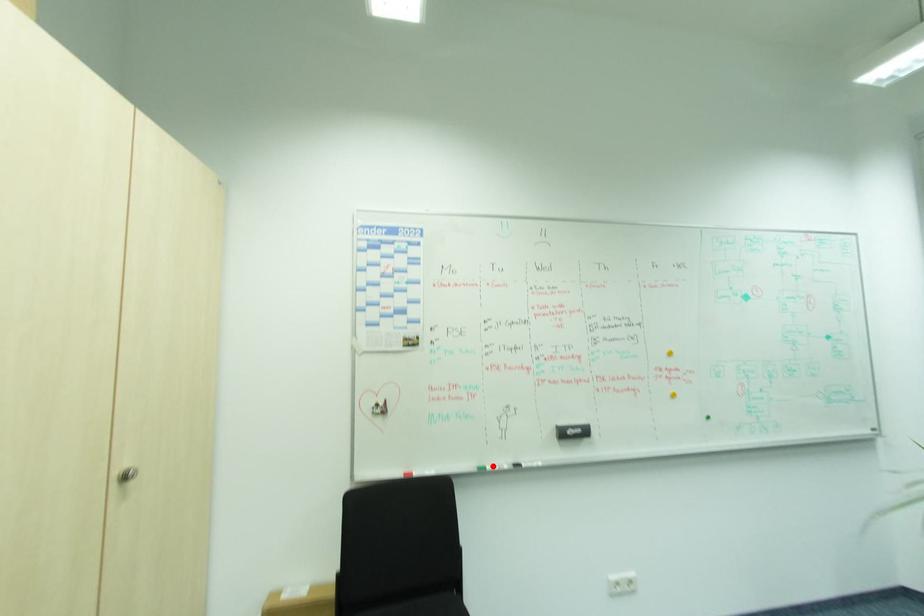
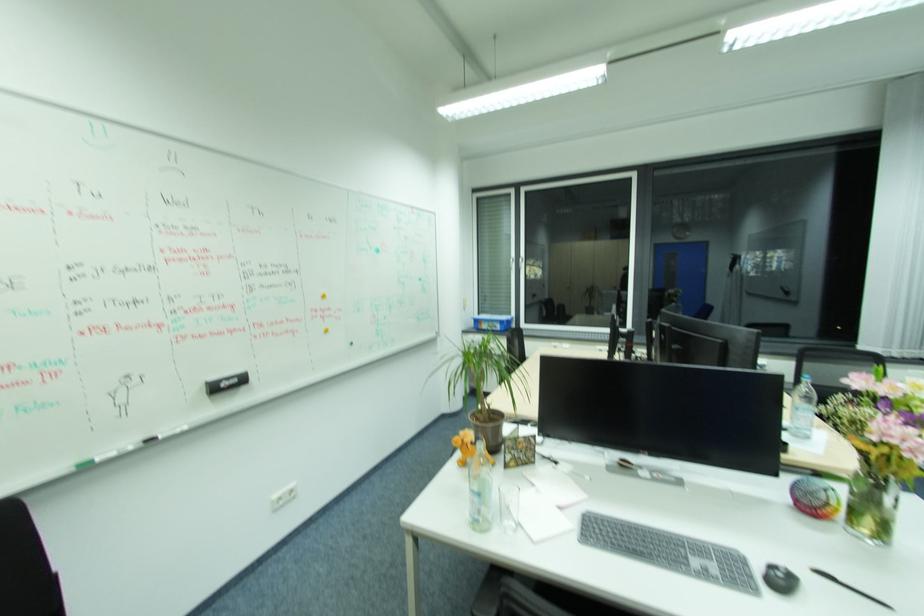
Question: I am providing you with two images of the same scene from different viewpoints. Image1 has a red point marked. In image2, the corresponding 3D location appears at what relative position? Reply with the corresponding letter.

Choices:
 (A) Closer
 (B) Farther

Answer: (A)